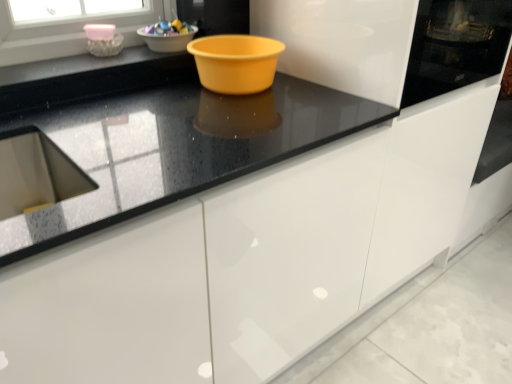
Question: Does black glossy countertop at upper center have a greater height compared to pink glass bowl at upper left, which is the first basin in left-to-right order?

Choices:
 (A) no
 (B) yes

Answer: (A)

Question: Is black glossy countertop at upper center wider than pink glass bowl at upper left, which is the first basin in left-to-right order?

Choices:
 (A) yes
 (B) no

Answer: (A)

Question: Is black glossy countertop at upper center completely or partially outside of pink glass bowl at upper left, the 2th basin when ordered from right to left?

Choices:
 (A) yes
 (B) no

Answer: (A)

Question: Considering the relative positions of black glossy countertop at upper center and pink glass bowl at upper left, which is the first basin in left-to-right order, in the image provided, is black glossy countertop at upper center in front of pink glass bowl at upper left, which is the first basin in left-to-right order,?

Choices:
 (A) yes
 (B) no

Answer: (A)

Question: Does black glossy countertop at upper center lie behind pink glass bowl at upper left, which is the first basin in left-to-right order?

Choices:
 (A) no
 (B) yes

Answer: (A)

Question: Considering their positions, is black glossy countertop at upper center located in front of or behind shiny plastic bowl at upper center?

Choices:
 (A) front
 (B) behind

Answer: (A)

Question: Considering the positions of black glossy countertop at upper center and shiny plastic bowl at upper center in the image, is black glossy countertop at upper center bigger or smaller than shiny plastic bowl at upper center?

Choices:
 (A) small
 (B) big

Answer: (B)

Question: Considering the positions of black glossy countertop at upper center and shiny plastic bowl at upper center in the image, is black glossy countertop at upper center taller or shorter than shiny plastic bowl at upper center?

Choices:
 (A) short
 (B) tall

Answer: (A)

Question: From a real-world perspective, relative to shiny plastic bowl at upper center, is black glossy countertop at upper center vertically above or below?

Choices:
 (A) below
 (B) above

Answer: (A)

Question: Looking at their shapes, would you say black glossy countertop at upper center is wider or thinner than matte plastic bowl at upper center, which appears as the 1th basin when viewed from the right?

Choices:
 (A) wide
 (B) thin

Answer: (A)

Question: Considering their positions, is black glossy countertop at upper center located in front of or behind matte plastic bowl at upper center, which appears as the 1th basin when viewed from the right?

Choices:
 (A) behind
 (B) front

Answer: (B)

Question: Considering the positions of black glossy countertop at upper center and matte plastic bowl at upper center, which appears as the 1th basin when viewed from the right, in the image, is black glossy countertop at upper center taller or shorter than matte plastic bowl at upper center, which appears as the 1th basin when viewed from the right,?

Choices:
 (A) short
 (B) tall

Answer: (A)

Question: Is black glossy countertop at upper center to the left or to the right of matte plastic bowl at upper center, which appears as the 1th basin when viewed from the right, in the image?

Choices:
 (A) left
 (B) right

Answer: (A)

Question: From a real-world perspective, is black glossy countertop at center positioned above or below black glossy countertop at upper center?

Choices:
 (A) below
 (B) above

Answer: (A)

Question: From the image's perspective, is black glossy countertop at center located above or below black glossy countertop at upper center?

Choices:
 (A) below
 (B) above

Answer: (A)